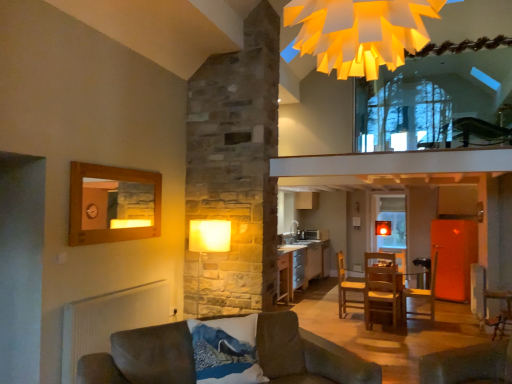
Question: Can you confirm if yellow paper chandelier at upper center is positioned to the right of velvet brown armchair at lower right, arranged as the second armchair when viewed from the back?

Choices:
 (A) yes
 (B) no

Answer: (A)

Question: Can you confirm if yellow paper chandelier at upper center is wider than velvet brown armchair at lower right, placed as the first armchair when sorted from front to back?

Choices:
 (A) no
 (B) yes

Answer: (B)

Question: Is yellow paper chandelier at upper center smaller than velvet brown armchair at lower right, arranged as the second armchair when viewed from the back?

Choices:
 (A) no
 (B) yes

Answer: (A)

Question: Is yellow paper chandelier at upper center to the left of velvet brown armchair at lower right, arranged as the second armchair when viewed from the back, from the viewer's perspective?

Choices:
 (A) no
 (B) yes

Answer: (A)

Question: Is yellow paper chandelier at upper center next to velvet brown armchair at lower right, which is the second armchair in left-to-right order?

Choices:
 (A) no
 (B) yes

Answer: (A)

Question: Considering the relative positions of transparent glass window at upper center and wooden chair at center, which ranks as the 1th armchair in left-to-right order, in the image provided, is transparent glass window at upper center to the left or to the right of wooden chair at center, which ranks as the 1th armchair in left-to-right order,?

Choices:
 (A) left
 (B) right

Answer: (B)

Question: From the image's perspective, is transparent glass window at upper center located above or below wooden chair at center, the first armchair viewed from the back?

Choices:
 (A) above
 (B) below

Answer: (A)

Question: Considering their positions, is transparent glass window at upper center located in front of or behind wooden chair at center, which is the 2th armchair from front to back?

Choices:
 (A) front
 (B) behind

Answer: (A)

Question: From their relative heights in the image, would you say transparent glass window at upper center is taller or shorter than wooden chair at center, which is counted as the 2th armchair, starting from the right?

Choices:
 (A) short
 (B) tall

Answer: (B)

Question: From the image's perspective, relative to velvet brown couch at lower left, is wooden table at center above or below?

Choices:
 (A) below
 (B) above

Answer: (A)

Question: In terms of height, does wooden table at center look taller or shorter compared to velvet brown couch at lower left?

Choices:
 (A) short
 (B) tall

Answer: (B)

Question: Based on their sizes in the image, would you say wooden table at center is bigger or smaller than velvet brown couch at lower left?

Choices:
 (A) small
 (B) big

Answer: (A)

Question: Is wooden table at center spatially inside velvet brown couch at lower left, or outside of it?

Choices:
 (A) inside
 (B) outside

Answer: (B)

Question: In the image, is velvet brown couch at lower left positioned in front of or behind velvet brown armchair at lower right, placed as the first armchair when sorted from front to back?

Choices:
 (A) front
 (B) behind

Answer: (A)

Question: In terms of size, does velvet brown couch at lower left appear bigger or smaller than velvet brown armchair at lower right, which appears as the 1th armchair when viewed from the right?

Choices:
 (A) big
 (B) small

Answer: (A)